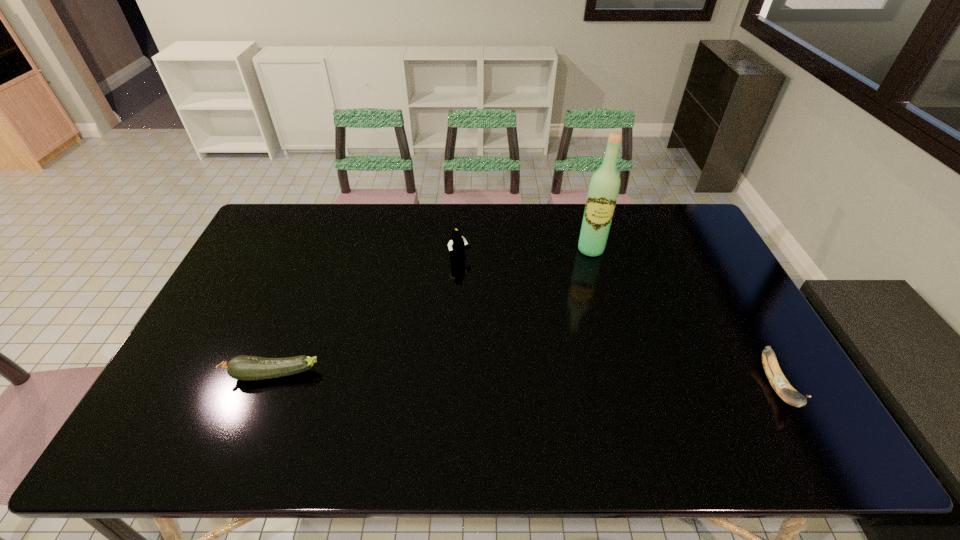
Locate an element on the screen. vacant region between the zucchini and the wine bottle is located at coordinates (432, 312).

You are a GUI agent. You are given a task and a screenshot of the screen. Output one action in this format:
    pyautogui.click(x=<x>, y=<y>)
    Task: Click on the free space between the second object from right to left and the third object from right to left
    
    Given the screenshot: What is the action you would take?
    pyautogui.click(x=525, y=255)

Find the location of a particular element. The width and height of the screenshot is (960, 540). blank region between the shortest object and the tallest object is located at coordinates (432, 312).

Locate an element on the screen. This screenshot has width=960, height=540. free space between the leftmost object and the second tallest object is located at coordinates (367, 318).

The image size is (960, 540). Find the location of `vacant area that lies between the second object from right to left and the shortest object`. vacant area that lies between the second object from right to left and the shortest object is located at coordinates (432, 312).

This screenshot has height=540, width=960. I want to click on vacant space in between the wine bottle and the second object from left to right, so pos(525,255).

This screenshot has height=540, width=960. I want to click on vacant space that's between the third object from left to right and the rightmost object, so click(684, 318).

You are a GUI agent. You are given a task and a screenshot of the screen. Output one action in this format:
    pyautogui.click(x=<x>, y=<y>)
    Task: Click on the free space between the second object from right to left and the zucchini
    
    Given the screenshot: What is the action you would take?
    pyautogui.click(x=432, y=312)

Where is `empty location between the banana and the tallest object`? Image resolution: width=960 pixels, height=540 pixels. empty location between the banana and the tallest object is located at coordinates (684, 318).

Identify which object is located as the second nearest to the banana. Please provide its 2D coordinates. Your answer should be formatted as a tuple, i.e. [(x, y)], where the tuple contains the x and y coordinates of a point satisfying the conditions above.

[(456, 245)]